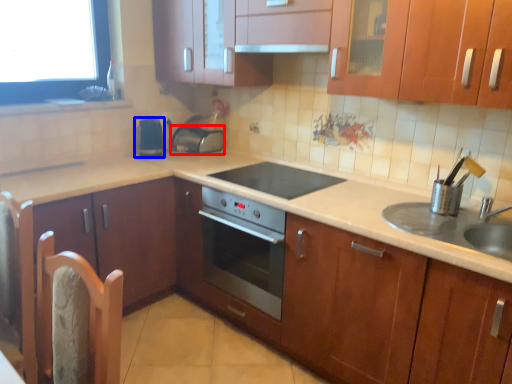
Question: Among these objects, which one is farthest to the camera, appliance (highlighted by a red box) or appliance (highlighted by a blue box)?

Choices:
 (A) appliance
 (B) appliance

Answer: (A)